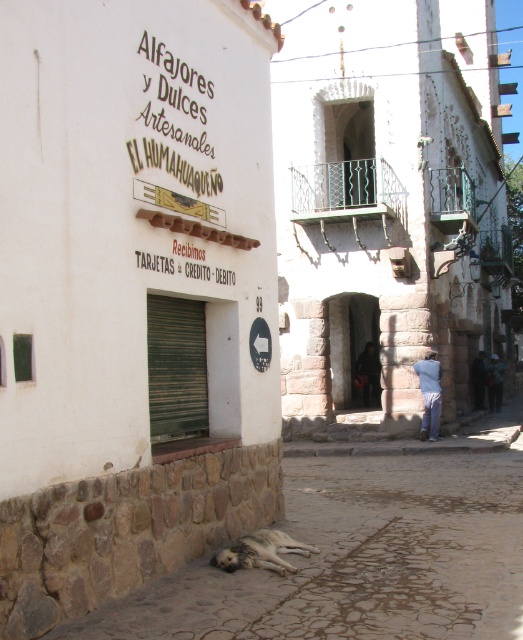
Question: Is brown fur dog at lower center to the left of blue jeans at lower right from the viewer's perspective?

Choices:
 (A) yes
 (B) no

Answer: (A)

Question: Among these objects, which one is nearest to the camera?

Choices:
 (A) gray cobblestone pavement at lower center
 (B) blue jeans at lower right
 (C) brown fur dog at lower center

Answer: (A)

Question: Can you confirm if gray cobblestone pavement at lower center is positioned to the right of brown fur dog at lower center?

Choices:
 (A) no
 (B) yes

Answer: (A)

Question: Which object appears closest to the camera in this image?

Choices:
 (A) blue jeans at lower right
 (B) gray cobblestone pavement at lower center
 (C) brown fur dog at lower center

Answer: (B)

Question: Estimate the real-world distances between objects in this image. Which object is closer to the blue jeans at lower right?

Choices:
 (A) brown fur dog at lower center
 (B) gray cobblestone pavement at lower center

Answer: (A)

Question: Is gray cobblestone pavement at lower center positioned in front of brown fur dog at lower center?

Choices:
 (A) yes
 (B) no

Answer: (A)